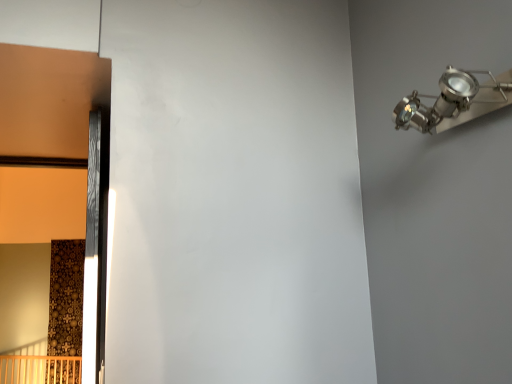
Question: Can you confirm if metallic silver spotlight at upper right is shorter than wooden door at left?

Choices:
 (A) yes
 (B) no

Answer: (A)

Question: Would you say metallic silver spotlight at upper right is outside wooden door at left?

Choices:
 (A) yes
 (B) no

Answer: (A)

Question: Considering the relative positions of metallic silver spotlight at upper right and wooden door at left in the image provided, is metallic silver spotlight at upper right to the right of wooden door at left from the viewer's perspective?

Choices:
 (A) no
 (B) yes

Answer: (B)

Question: Is metallic silver spotlight at upper right behind wooden door at left?

Choices:
 (A) yes
 (B) no

Answer: (B)

Question: Is metallic silver spotlight at upper right at the left side of wooden door at left?

Choices:
 (A) yes
 (B) no

Answer: (B)

Question: Is metallic silver spotlight at upper right wider than wooden door at left?

Choices:
 (A) no
 (B) yes

Answer: (B)

Question: Is wooden door at left far away from metallic silver spotlight at upper right?

Choices:
 (A) no
 (B) yes

Answer: (A)

Question: Is wooden door at left outside of metallic silver spotlight at upper right?

Choices:
 (A) yes
 (B) no

Answer: (A)

Question: Can you confirm if wooden door at left is taller than metallic silver spotlight at upper right?

Choices:
 (A) no
 (B) yes

Answer: (B)

Question: From the image's perspective, is wooden door at left below metallic silver spotlight at upper right?

Choices:
 (A) no
 (B) yes

Answer: (B)

Question: Is wooden door at left with metallic silver spotlight at upper right?

Choices:
 (A) yes
 (B) no

Answer: (B)

Question: Does wooden door at left have a larger size compared to metallic silver spotlight at upper right?

Choices:
 (A) no
 (B) yes

Answer: (B)

Question: Visually, is wooden door at left positioned to the left or to the right of metallic silver spotlight at upper right?

Choices:
 (A) left
 (B) right

Answer: (A)